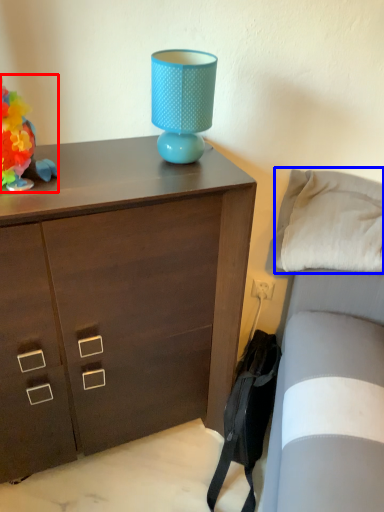
Question: Which of the following is the farthest to the observer, toy (highlighted by a red box) or pillow (highlighted by a blue box)?

Choices:
 (A) toy
 (B) pillow

Answer: (B)